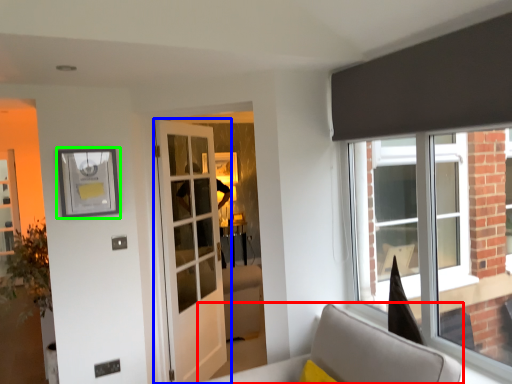
Question: Which object is positioned farthest from furniture (highlighted by a red box)? Select from door (highlighted by a blue box) and picture frame (highlighted by a green box).

Choices:
 (A) door
 (B) picture frame

Answer: (B)